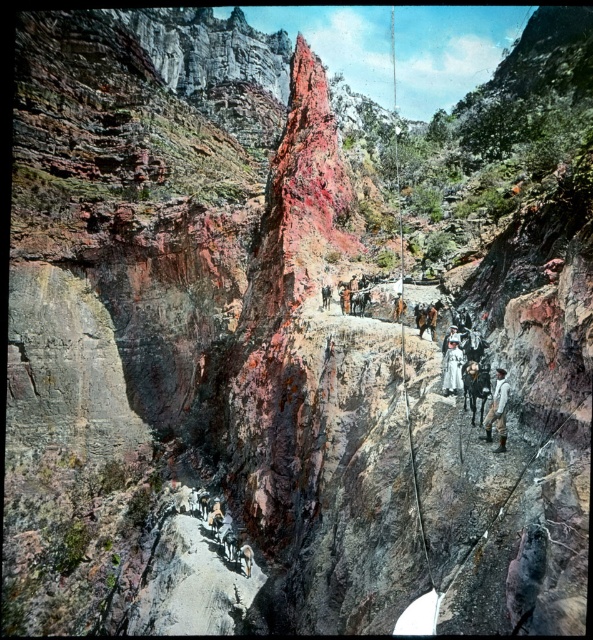
Question: Which object is farther from the camera taking this photo?

Choices:
 (A) white leather boots at lower right
 (B) light brown leather pants at lower right
 (C) white cotton shirt at right

Answer: (C)

Question: Estimate the real-world distances between objects in this image. Which object is farther from the white cotton shirt at right?

Choices:
 (A) light brown leather pants at lower right
 (B) white leather boots at lower right

Answer: (A)

Question: Can you confirm if light brown leather pants at lower right is smaller than white leather boots at lower right?

Choices:
 (A) no
 (B) yes

Answer: (A)

Question: Which object is positioned closest to the white leather boots at lower right?

Choices:
 (A) light brown leather pants at lower right
 (B) white cotton shirt at right

Answer: (A)

Question: Can you confirm if light brown leather pants at lower right is positioned to the right of white cotton shirt at right?

Choices:
 (A) yes
 (B) no

Answer: (A)

Question: Is light brown leather pants at lower right to the right of white cotton shirt at right from the viewer's perspective?

Choices:
 (A) no
 (B) yes

Answer: (B)